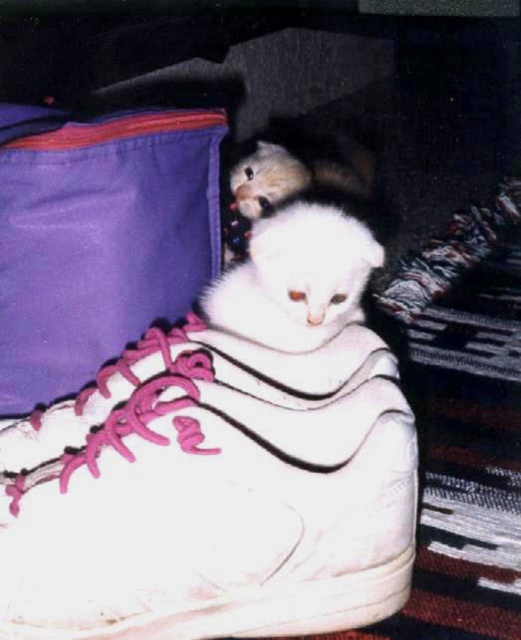
Question: Which point is closer to the camera?

Choices:
 (A) (286, 301)
 (B) (334, 586)

Answer: (B)

Question: Does white matte sneaker at center have a smaller size compared to white fluffy cat at center?

Choices:
 (A) yes
 (B) no

Answer: (B)

Question: Observing the image, what is the correct spatial positioning of white matte sneaker at center in reference to white fluffy cat at center?

Choices:
 (A) below
 (B) above

Answer: (A)

Question: Does white matte sneaker at center have a greater width compared to white fluffy cat at center?

Choices:
 (A) yes
 (B) no

Answer: (A)

Question: Which point is closer to the camera?

Choices:
 (A) (369, 355)
 (B) (337, 284)

Answer: (A)

Question: Which point appears closest to the camera in this image?

Choices:
 (A) (204, 307)
 (B) (245, 550)

Answer: (B)